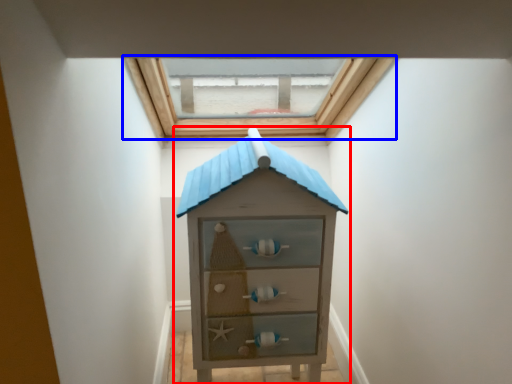
Question: Which object is further to the camera taking this photo, chest of drawers (highlighted by a red box) or window (highlighted by a blue box)?

Choices:
 (A) chest of drawers
 (B) window

Answer: (B)